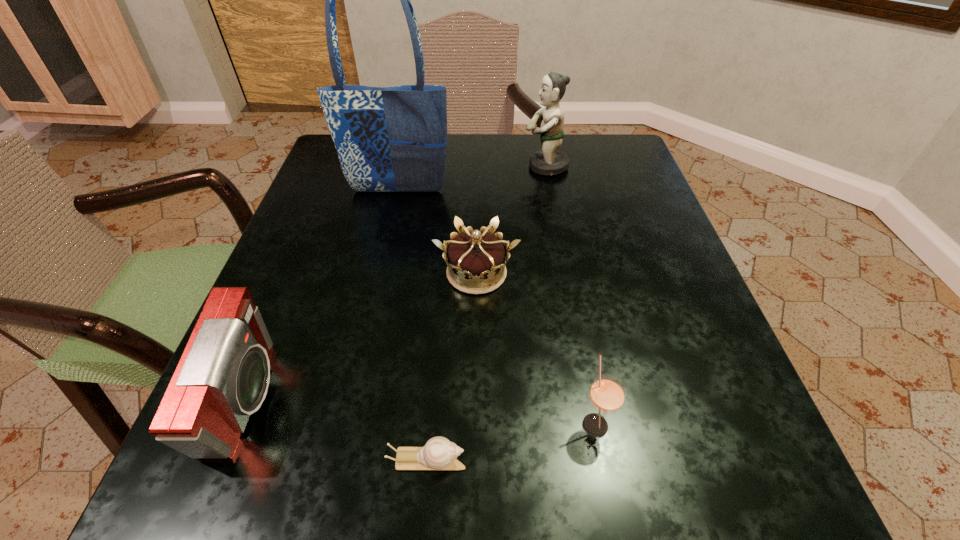
Image resolution: width=960 pixels, height=540 pixels. What are the coordinates of `vacant area that lies between the crown and the escargot` in the screenshot? It's located at (452, 367).

Locate an element on the screen. free space that is in between the camera and the figurine is located at coordinates click(396, 283).

Locate an element on the screen. empty space between the crown and the fifth nearest object is located at coordinates (437, 232).

What are the coordinates of `free space between the straw and the fourth nearest object` in the screenshot? It's located at (536, 348).

Select which object appears as the third closest to the camera. Please provide its 2D coordinates. Your answer should be formatted as a tuple, i.e. [(x, y)], where the tuple contains the x and y coordinates of a point satisfying the conditions above.

[(389, 139)]

Identify which object is located as the nearest to the camera. Please provide its 2D coordinates. Your answer should be formatted as a tuple, i.e. [(x, y)], where the tuple contains the x and y coordinates of a point satisfying the conditions above.

[(439, 453)]

Identify the location of blank area in the image that satisfies the following two spatial constraints: 1. on the front-facing side of the straw; 2. on the left side of the figurine. The width and height of the screenshot is (960, 540). (594, 424).

This screenshot has width=960, height=540. What are the coordinates of `free location that satisfies the following two spatial constraints: 1. on the front side of the third farthest object; 2. on the shell of the escargot` in the screenshot? It's located at (475, 461).

This screenshot has height=540, width=960. Find the location of `free point that satisfies the following two spatial constraints: 1. on the front side of the fifth tallest object; 2. on the shell of the escargot`. free point that satisfies the following two spatial constraints: 1. on the front side of the fifth tallest object; 2. on the shell of the escargot is located at coordinates (475, 461).

Where is `free space that satisfies the following two spatial constraints: 1. on the front-facing side of the tallest object; 2. on the front-facing side of the camera`? The width and height of the screenshot is (960, 540). free space that satisfies the following two spatial constraints: 1. on the front-facing side of the tallest object; 2. on the front-facing side of the camera is located at coordinates (351, 400).